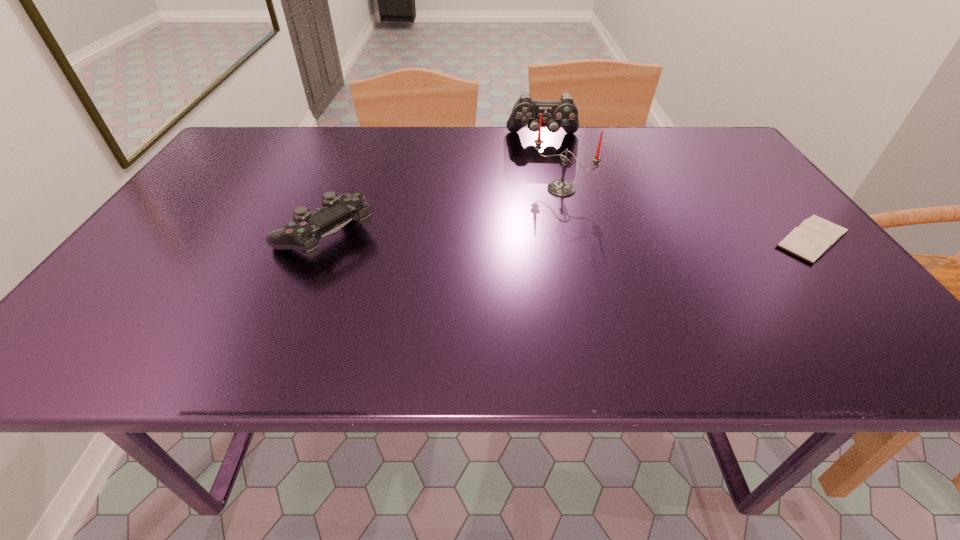
In order to click on empty space between the rightmost object and the right control in this screenshot , I will do `click(678, 188)`.

Where is `unoccupied position between the farthest object and the tallest object`? The height and width of the screenshot is (540, 960). unoccupied position between the farthest object and the tallest object is located at coordinates (552, 163).

The height and width of the screenshot is (540, 960). Identify the location of free area in between the tallest object and the second shortest object. (443, 212).

Where is `free space between the rightmost object and the shorter control`? This screenshot has width=960, height=540. free space between the rightmost object and the shorter control is located at coordinates (568, 237).

Where is `object that can be found as the second closest to the rightmost object`? This screenshot has height=540, width=960. object that can be found as the second closest to the rightmost object is located at coordinates [563, 113].

Image resolution: width=960 pixels, height=540 pixels. I want to click on object that stands as the second closest to the candle, so click(x=815, y=236).

The width and height of the screenshot is (960, 540). Find the location of `vacant position in the image that satisfies the following two spatial constraints: 1. on the front side of the third tallest object; 2. on the right side of the rightmost object`. vacant position in the image that satisfies the following two spatial constraints: 1. on the front side of the third tallest object; 2. on the right side of the rightmost object is located at coordinates (323, 239).

This screenshot has height=540, width=960. What are the coordinates of `vacant position in the image that satisfies the following two spatial constraints: 1. on the front side of the farthest object; 2. on the right side of the tallest object` in the screenshot? It's located at (554, 189).

Where is `free space in the image that satisfies the following two spatial constraints: 1. on the front side of the third shortest object; 2. on the left side of the third nearest object`? The width and height of the screenshot is (960, 540). free space in the image that satisfies the following two spatial constraints: 1. on the front side of the third shortest object; 2. on the left side of the third nearest object is located at coordinates [554, 189].